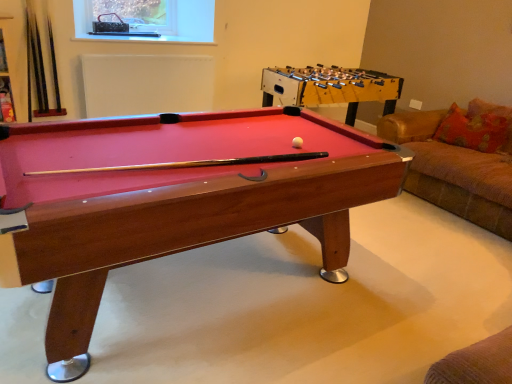
Question: In terms of width, does metallic mesh at upper center look wider or thinner when compared to wooden foosball table at center?

Choices:
 (A) wide
 (B) thin

Answer: (B)

Question: Considering the relative positions of metallic mesh at upper center and wooden foosball table at center in the image provided, is metallic mesh at upper center to the left or to the right of wooden foosball table at center?

Choices:
 (A) right
 (B) left

Answer: (B)

Question: Which of these objects is positioned farthest from the metallic mesh at upper center?

Choices:
 (A) orange fabric pillow at right
 (B) white matte ball at center
 (C) wooden billiard table at center
 (D) wooden foosball table at center

Answer: (B)

Question: Based on their relative distances, which object is nearer to the wooden billiard table at center?

Choices:
 (A) white matte ball at center
 (B) orange fabric pillow at right
 (C) metallic mesh at upper center
 (D) wooden foosball table at center

Answer: (A)